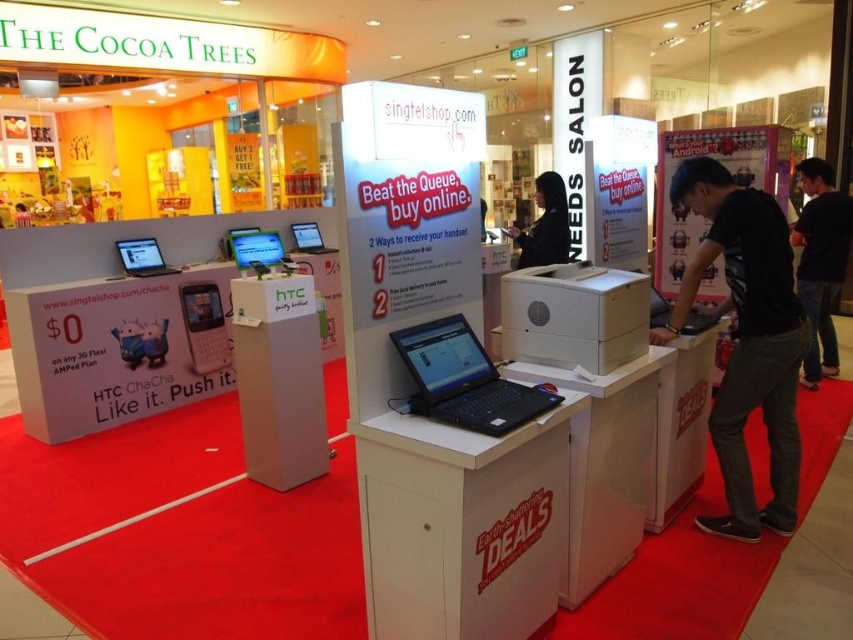
Question: Is black cotton shirt at center to the left of matte black laptop at center from the viewer's perspective?

Choices:
 (A) no
 (B) yes

Answer: (A)

Question: Can you confirm if black cotton shirt at right is thinner than matte black laptop at left?

Choices:
 (A) no
 (B) yes

Answer: (A)

Question: Does black glossy laptop at center have a larger size compared to matte black laptop at left?

Choices:
 (A) yes
 (B) no

Answer: (A)

Question: Estimate the real-world distances between objects in this image. Which object is farther from the matte black laptop at left?

Choices:
 (A) black fabric hair at center
 (B) black cotton shirt at center

Answer: (B)

Question: Which object appears closest to the camera in this image?

Choices:
 (A) matte black laptop at center
 (B) black cotton shirt at right

Answer: (B)

Question: Based on their relative distances, which object is farther from the black cotton shirt at center?

Choices:
 (A) silver metallic laptop at center
 (B) black fabric hair at center
 (C) matte black laptop at center
 (D) matte black laptop at left

Answer: (A)